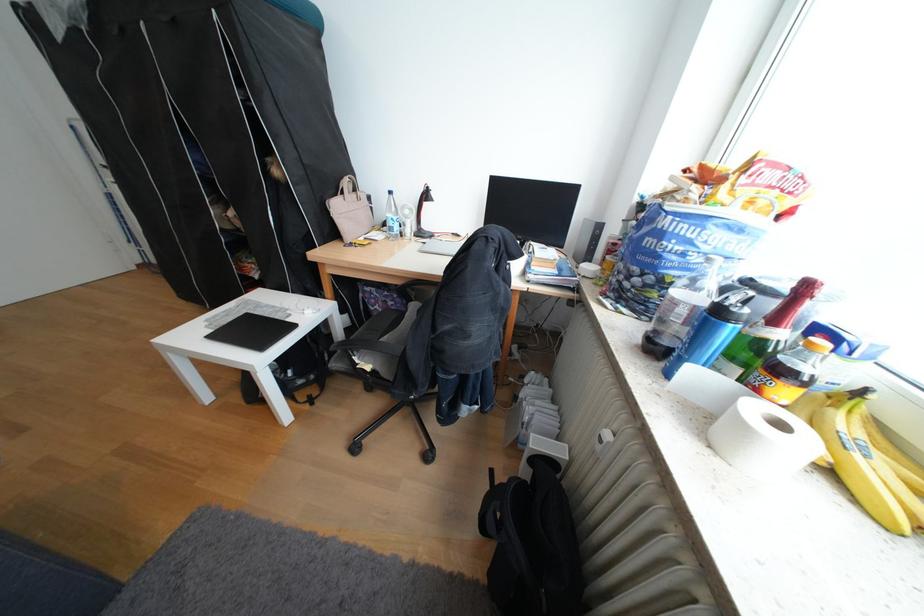
Find where to lift the white bag handle. Please return your answer as a coordinate pair (x, y).

(349, 190)